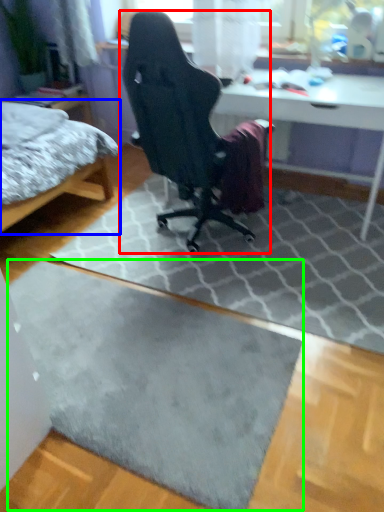
Question: Based on their relative distances, which object is nearer to chair (highlighted by a red box)? Choose from bed (highlighted by a blue box) and doormat (highlighted by a green box).

Choices:
 (A) bed
 (B) doormat

Answer: (A)